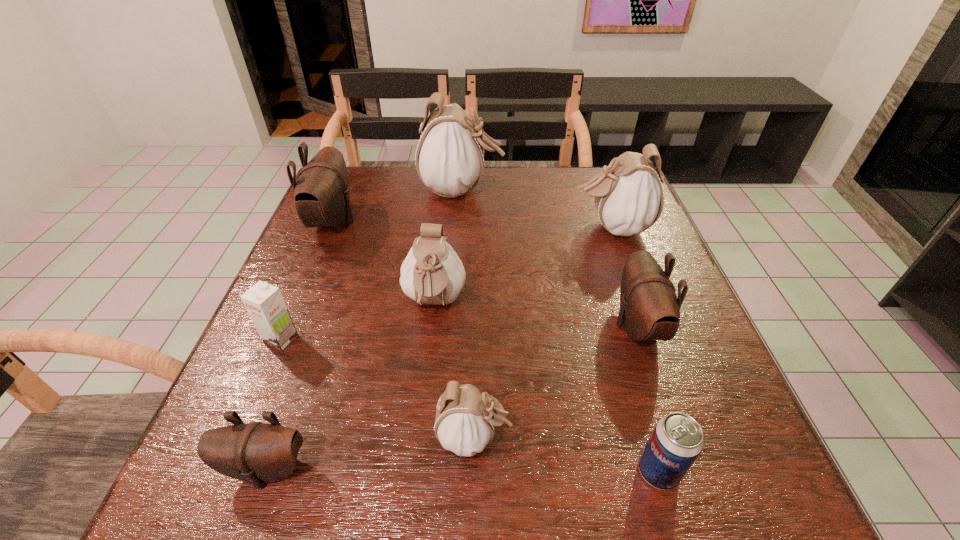
I want to click on vacant region at the far edge of the desktop, so click(416, 191).

Locate an element on the screen. The image size is (960, 540). free spot at the near edge of the desktop is located at coordinates (292, 503).

Identify the location of vacant region at the left edge of the desktop. click(x=293, y=267).

Where is `vacant space at the right edge of the desktop`? The height and width of the screenshot is (540, 960). vacant space at the right edge of the desktop is located at coordinates (743, 414).

This screenshot has width=960, height=540. I want to click on vacant position at the near right corner of the desktop, so click(741, 456).

Identify the location of empty space between the nearest brown pouch and the second nearest white pouch. (350, 386).

Where is `free space between the smallest brown pouch and the chocolate milk`? This screenshot has height=540, width=960. free space between the smallest brown pouch and the chocolate milk is located at coordinates click(275, 404).

In order to click on vacant area that lies between the second nearest white pouch and the second smallest brown pouch in this screenshot , I will do `click(536, 315)`.

Locate an element on the screen. The height and width of the screenshot is (540, 960). unoccupied area between the smallest brown pouch and the red beer can is located at coordinates (463, 470).

Identify the location of free space between the red beer can and the biggest white pouch. (560, 330).